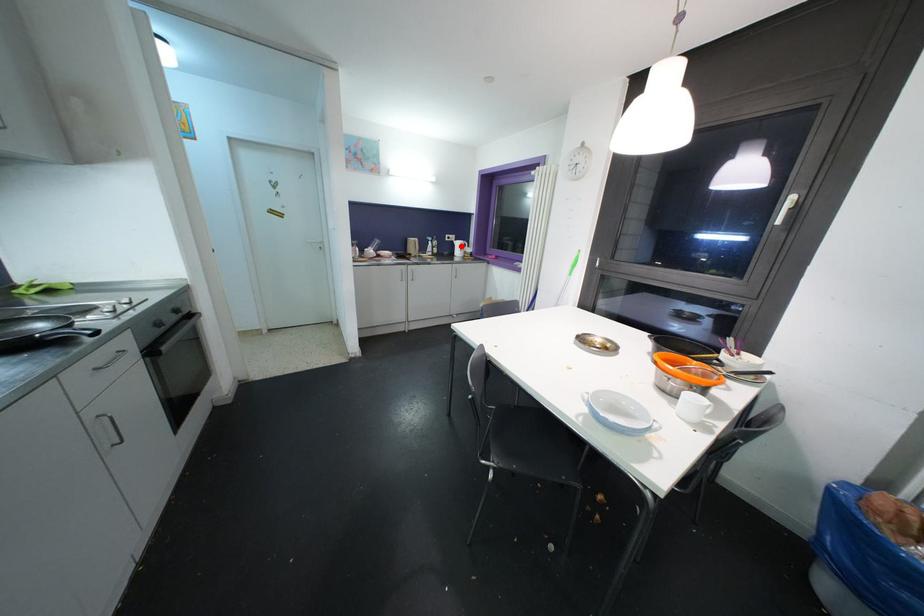
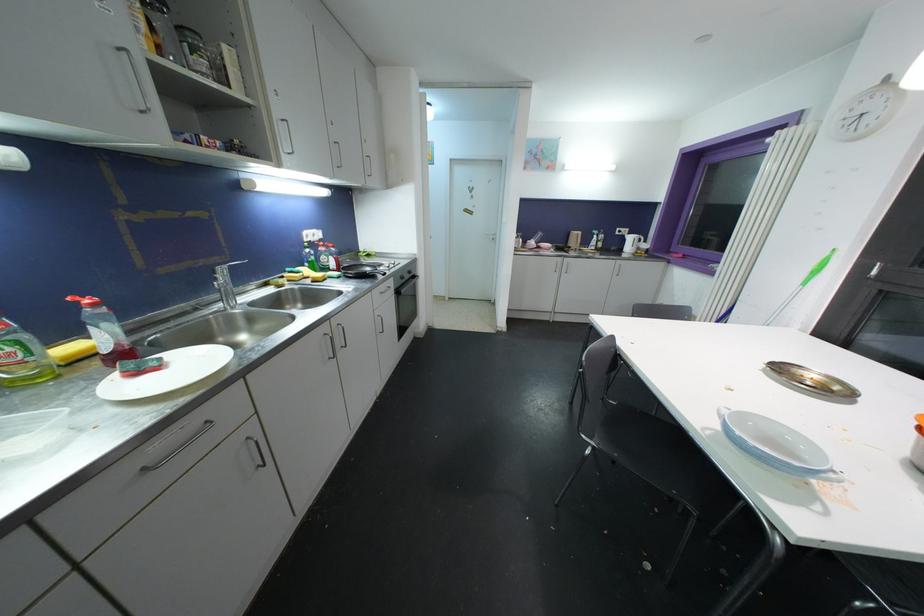
Find the pixel in the second image that matches the highlighted location in the first image.

(634, 241)